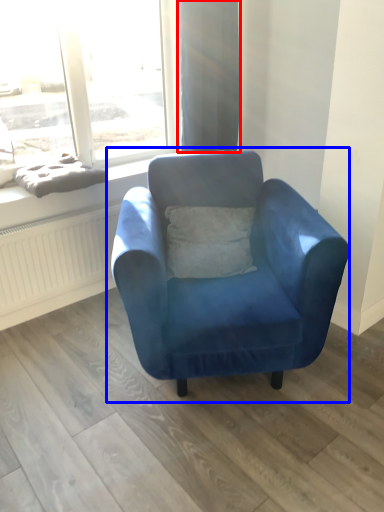
Question: Which object appears closest to the camera in this image, curtain (highlighted by a red box) or chair (highlighted by a blue box)?

Choices:
 (A) curtain
 (B) chair

Answer: (B)